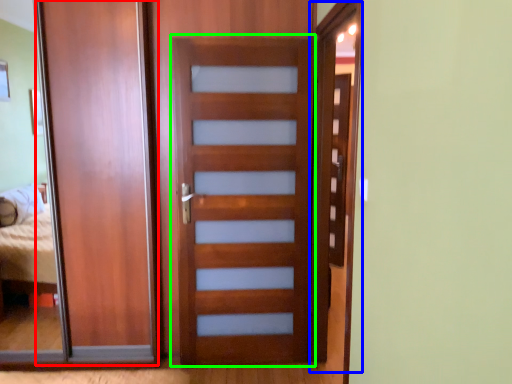
Question: Which is nearer to the barn door (highlighted by a red box)? screen door (highlighted by a blue box) or screen door (highlighted by a green box).

Choices:
 (A) screen door
 (B) screen door

Answer: (B)